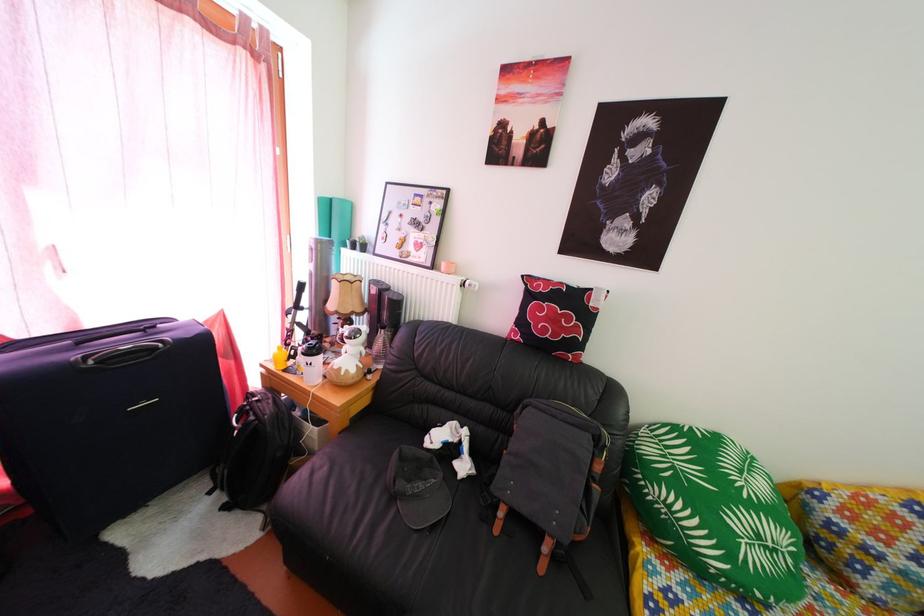
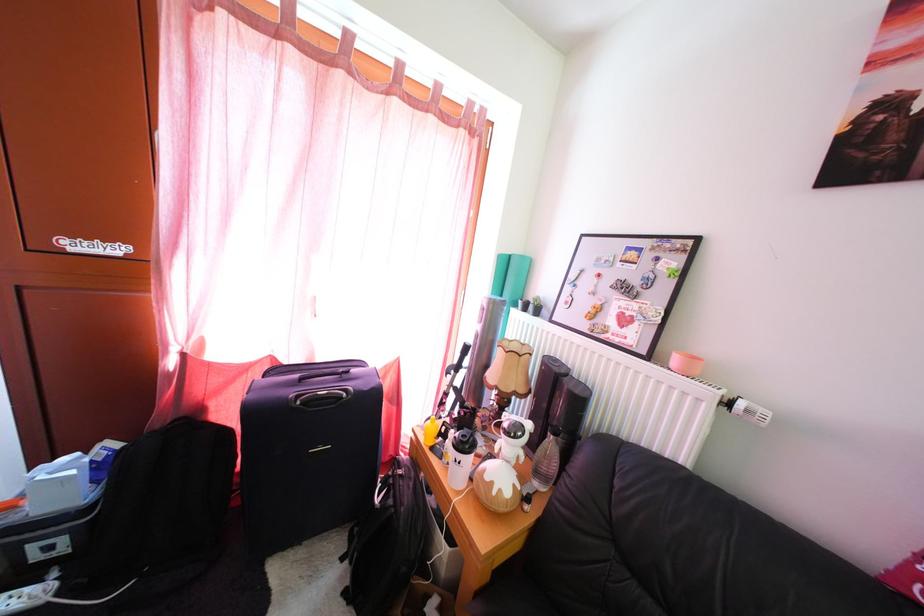
Question: The images are taken continuously from a first-person perspective. In which direction is your viewpoint rotating?

Choices:
 (A) Left
 (B) Right
 (C) Up
 (D) Down

Answer: (A)